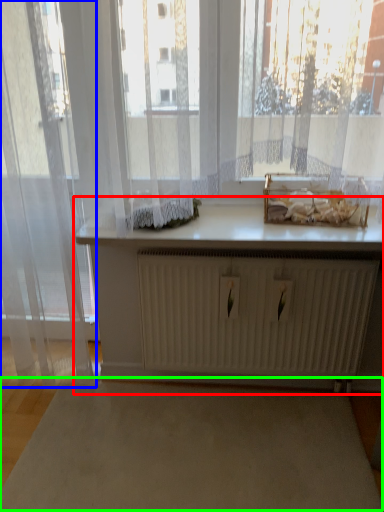
Question: Estimate the real-world distances between objects in this image. Which object is farther from table (highlighted by a red box), curtain (highlighted by a blue box) or plain (highlighted by a green box)?

Choices:
 (A) curtain
 (B) plain

Answer: (A)